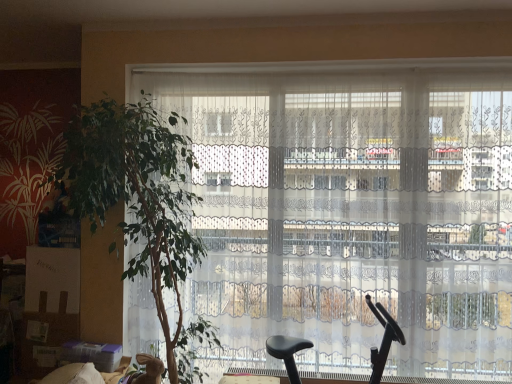
Question: From a real-world perspective, is black plastic baby carriage at center above or below white lace curtains at center?

Choices:
 (A) below
 (B) above

Answer: (A)

Question: Considering the positions of black plastic baby carriage at center and white lace curtains at center in the image, is black plastic baby carriage at center wider or thinner than white lace curtains at center?

Choices:
 (A) thin
 (B) wide

Answer: (B)

Question: Which object is positioned farthest from the white lace curtains at center?

Choices:
 (A) green leafy plant at left
 (B) black plastic baby carriage at center

Answer: (B)

Question: Considering the real-world distances, which object is closest to the white lace curtains at center?

Choices:
 (A) black plastic baby carriage at center
 (B) green leafy plant at left

Answer: (B)